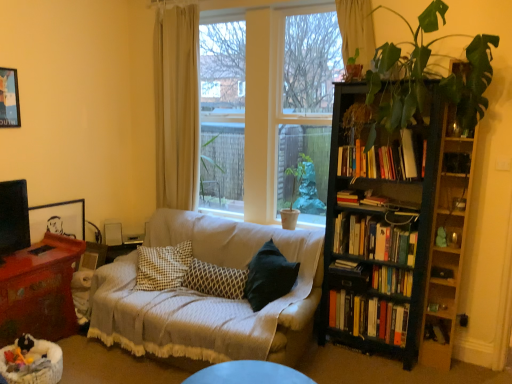
Find the location of a particular element. The width and height of the screenshot is (512, 384). vacant space in front of black wooden bookcase at right is located at coordinates (383, 372).